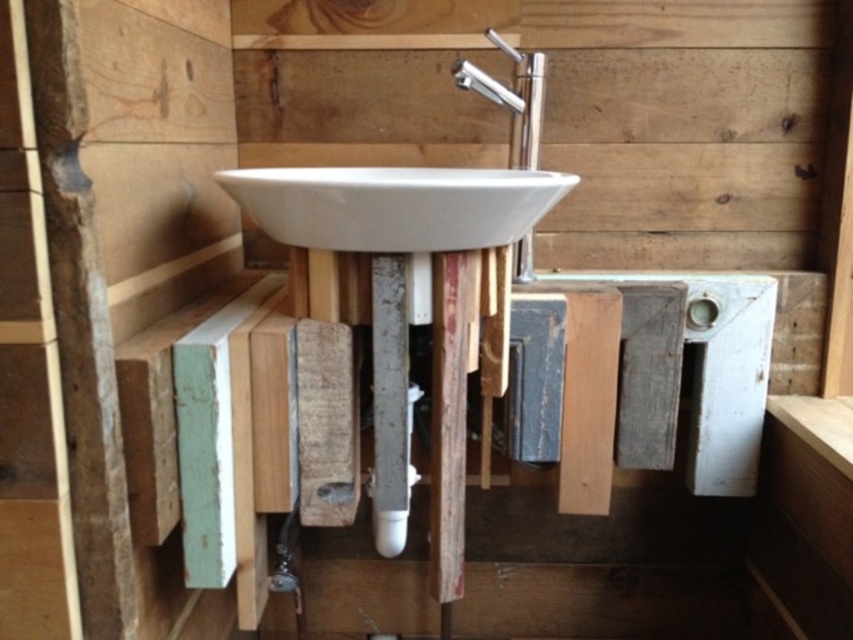
Does white glossy sink at center have a smaller size compared to silver metallic faucet at upper center?

Actually, white glossy sink at center might be larger than silver metallic faucet at upper center.

Can you confirm if white glossy sink at center is bigger than silver metallic faucet at upper center?

Yes.

Where is `white glossy sink at center`? The image size is (853, 640). white glossy sink at center is located at coordinates (393, 205).

At what (x,y) coordinates should I click in order to perform the action: click on white glossy sink at center. Please return your answer as a coordinate pair (x, y). Image resolution: width=853 pixels, height=640 pixels. Looking at the image, I should click on point(393,205).